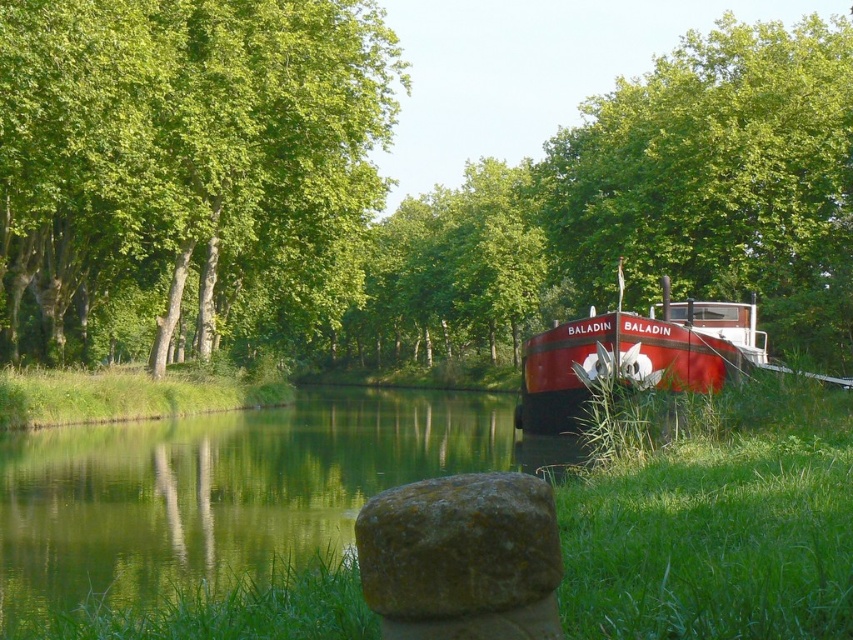
Question: Does green mossy rock at lower center have a smaller size compared to shiny red boat at right?

Choices:
 (A) no
 (B) yes

Answer: (B)

Question: From the image, what is the correct spatial relationship of green leafy trees at upper left in relation to shiny red boat at right?

Choices:
 (A) right
 (B) left

Answer: (B)

Question: Which of these objects is positioned closest to the green mossy rock at lower center?

Choices:
 (A) green grass at right
 (B) green leafy trees at upper left
 (C) green leafy tree at right

Answer: (A)

Question: Which is nearer to the green mossy rock at lower center?

Choices:
 (A) green leafy tree at right
 (B) green leafy trees at upper left
 (C) green grass at right
 (D) shiny red boat at right

Answer: (C)

Question: Does green leafy tree at right come in front of green leafy trees at upper left?

Choices:
 (A) yes
 (B) no

Answer: (A)

Question: Among these objects, which one is nearest to the camera?

Choices:
 (A) green mossy rock at lower center
 (B) green leafy tree at right

Answer: (A)